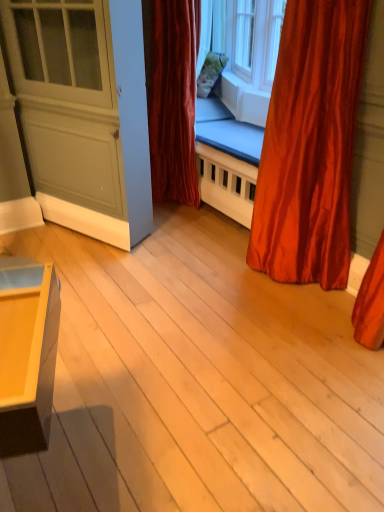
I want to click on free space to the left of satin red curtain at right, marked as the 1th curtain in a front-to-back arrangement, so click(216, 282).